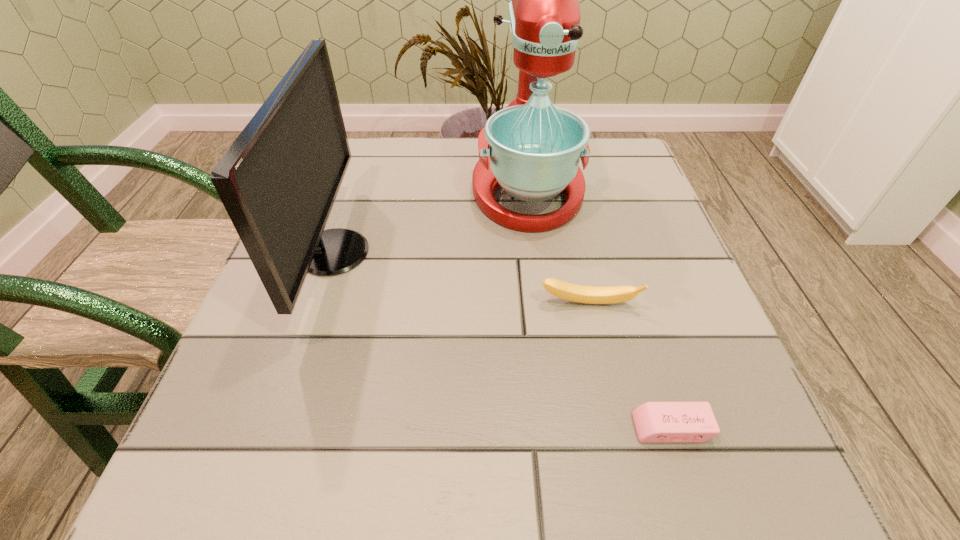
You are a GUI agent. You are given a task and a screenshot of the screen. Output one action in this format:
    pyautogui.click(x=<x>, y=<y>)
    Task: Click on the mixer that is at the far edge
    
    Given the screenshot: What is the action you would take?
    pyautogui.click(x=531, y=149)

You are a GUI agent. You are given a task and a screenshot of the screen. Output one action in this format:
    pyautogui.click(x=<x>, y=<y>)
    Task: Click on the computer monitor situated at the far edge
    The height and width of the screenshot is (540, 960).
    Given the screenshot: What is the action you would take?
    pyautogui.click(x=278, y=181)

Where is `object that is at the near edge`? The image size is (960, 540). object that is at the near edge is located at coordinates (655, 422).

Find the location of a particular element. object that is at the left edge is located at coordinates (278, 181).

Where is `mixer positioned at the right edge`? The image size is (960, 540). mixer positioned at the right edge is located at coordinates (531, 149).

Identify the location of banana that is at the right edge. (571, 292).

Where is `eraser that is at the right edge`? eraser that is at the right edge is located at coordinates (655, 422).

Where is `object located at the far left corner`? The image size is (960, 540). object located at the far left corner is located at coordinates pyautogui.click(x=278, y=181).

Where is `object located in the far right corner section of the desktop`? The height and width of the screenshot is (540, 960). object located in the far right corner section of the desktop is located at coordinates (531, 149).

In order to click on object that is positioned at the near right corner in this screenshot , I will do `click(655, 422)`.